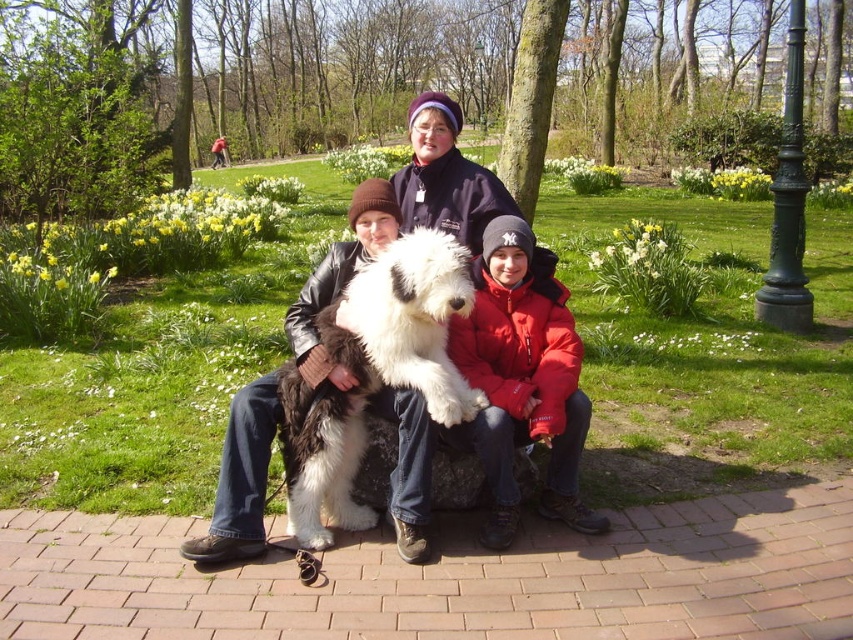
You are a photographer trying to capture a group photo of the three people and their dog. You need to ensure that the white fluffy dog at center and the red puffy jacket at center are both visible in the frame. Given the spatial relationship between them, is the dog wider than the jacket?

The white fluffy dog at center is wider than the red puffy jacket at center according to the description, so yes, the dog is wider than the jacket and both will be visible in the frame.

You are a photographer trying to capture a photo of the fluffy wool dog at center and the red puffy jacket at center. Since you want the dog to appear larger in the photo, should you move closer to the dog or the jacket?

The fluffy wool dog at center is shorter than the red puffy jacket at center. To make the dog appear larger in the photo, you should move closer to the dog.

What are the coordinates of the fluffy wool dog at center?

The coordinates of the fluffy wool dog at center are at point (401, 220).